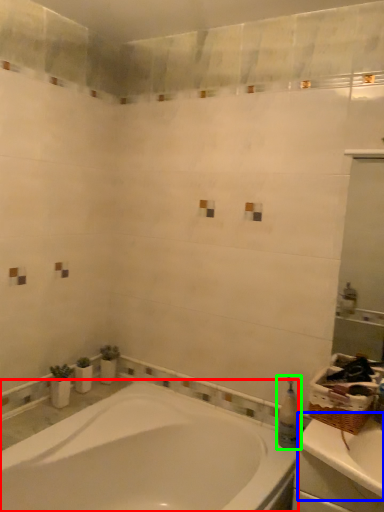
Question: Estimate the real-world distances between objects in this image. Which object is closer to bathtub (highlighted by a red box), counter top (highlighted by a blue box) or toiletry (highlighted by a green box)?

Choices:
 (A) counter top
 (B) toiletry

Answer: (A)